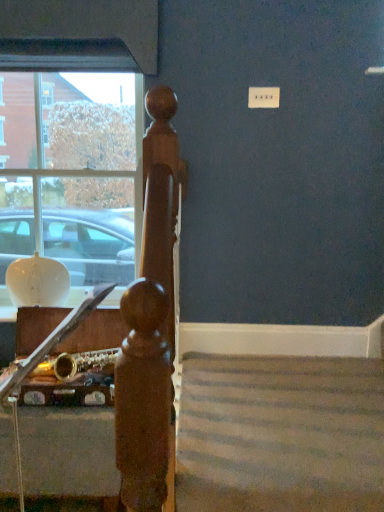
Question: Can you confirm if gold metallic saxophone at lower left is bigger than clear glass window at upper left?

Choices:
 (A) yes
 (B) no

Answer: (A)

Question: Considering the relative positions of gold metallic saxophone at lower left and clear glass window at upper left in the image provided, is gold metallic saxophone at lower left behind clear glass window at upper left?

Choices:
 (A) yes
 (B) no

Answer: (B)

Question: Could clear glass window at upper left be considered to be inside gold metallic saxophone at lower left?

Choices:
 (A) no
 (B) yes

Answer: (A)

Question: Can you confirm if gold metallic saxophone at lower left is taller than clear glass window at upper left?

Choices:
 (A) yes
 (B) no

Answer: (B)

Question: Considering the relative positions of gold metallic saxophone at lower left and clear glass window at upper left in the image provided, is gold metallic saxophone at lower left to the left of clear glass window at upper left from the viewer's perspective?

Choices:
 (A) no
 (B) yes

Answer: (A)

Question: Are gold metallic saxophone at lower left and clear glass window at upper left far apart?

Choices:
 (A) no
 (B) yes

Answer: (A)

Question: From a real-world perspective, is clear glass window at upper left over gold metallic saxophone at lower left?

Choices:
 (A) yes
 (B) no

Answer: (A)

Question: Is gold metallic saxophone at lower left at the back of clear glass window at upper left?

Choices:
 (A) yes
 (B) no

Answer: (B)

Question: Is clear glass window at upper left surrounding gold metallic saxophone at lower left?

Choices:
 (A) yes
 (B) no

Answer: (B)

Question: From the image's perspective, is clear glass window at upper left above gold metallic saxophone at lower left?

Choices:
 (A) yes
 (B) no

Answer: (A)

Question: Is clear glass window at upper left aimed at gold metallic saxophone at lower left?

Choices:
 (A) yes
 (B) no

Answer: (A)

Question: Is clear glass window at upper left thinner than gold metallic saxophone at lower left?

Choices:
 (A) no
 (B) yes

Answer: (B)

Question: From a real-world perspective, relative to gold metallic saxophone at lower left, is clear glass window at upper left vertically above or below?

Choices:
 (A) below
 (B) above

Answer: (B)